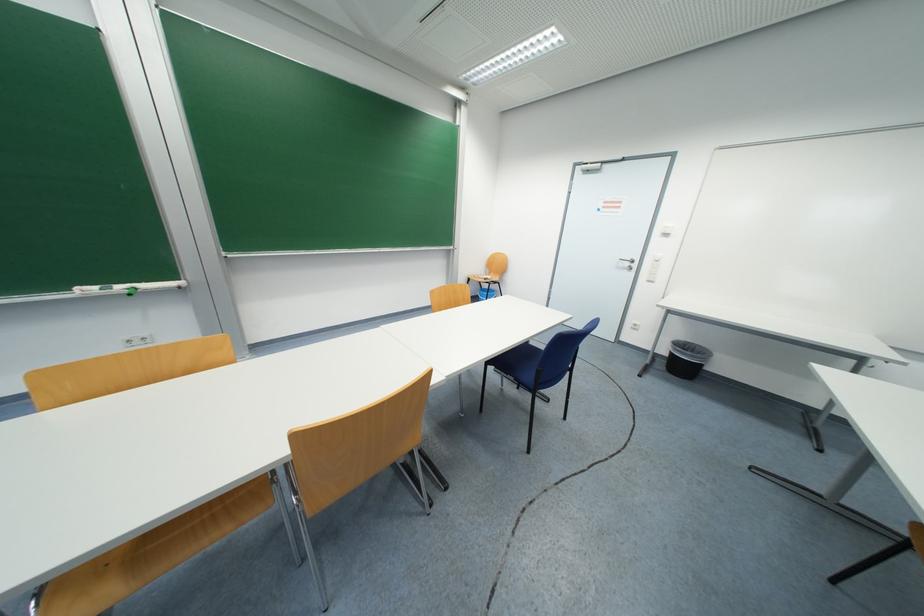
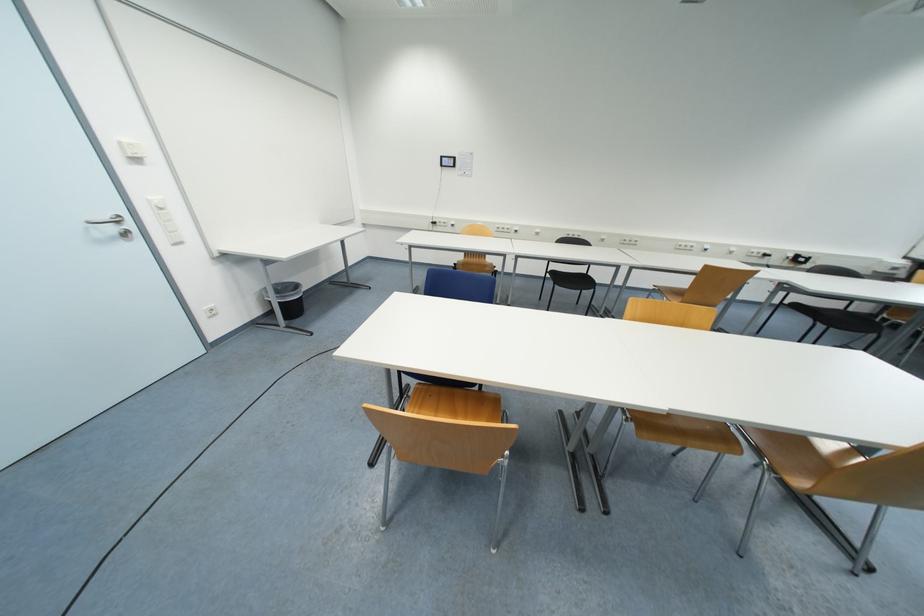
Where in the second image is the point corresponding to the point at 631,265 from the first image?

(117, 230)